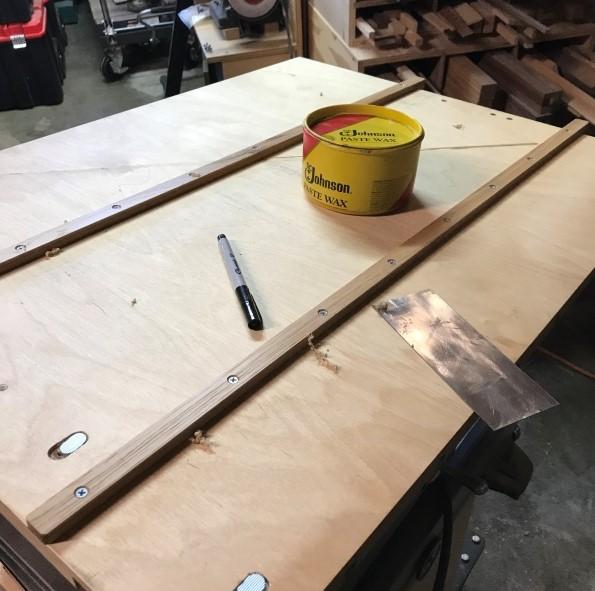
At what (x,y) coordinates should I click in order to perform the action: click on box. Please return your answer as a coordinate pair (x, y). This screenshot has width=595, height=591. Looking at the image, I should click on (33, 29).